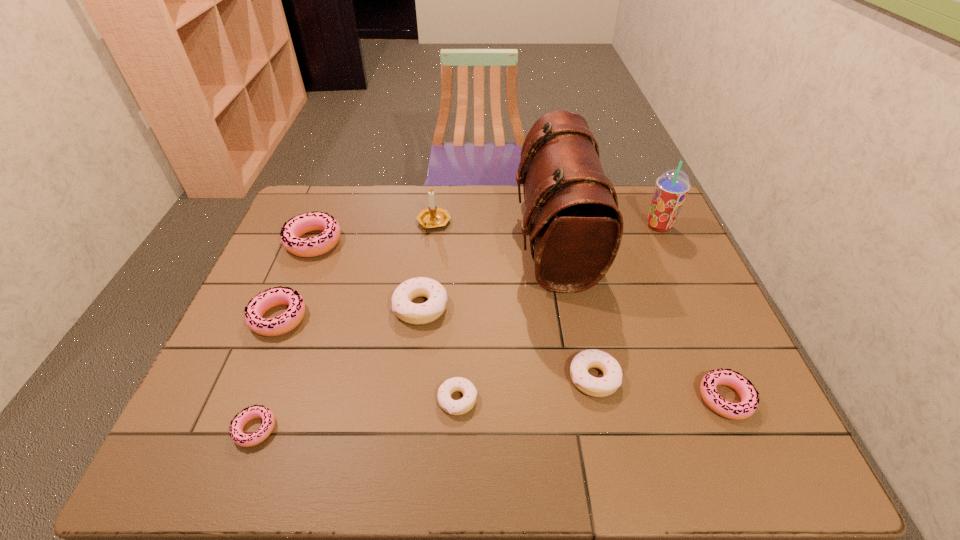
Find the location of `the second smallest white doughnut`. the second smallest white doughnut is located at coordinates pyautogui.click(x=597, y=387).

This screenshot has width=960, height=540. I want to click on the rightmost pink doughnut, so click(x=749, y=402).

What are the coordinates of `the third biggest pink doughnut` in the screenshot? It's located at (749, 402).

Locate an element on the screen. The height and width of the screenshot is (540, 960). the smallest white doughnut is located at coordinates (454, 407).

Locate an element on the screen. The width and height of the screenshot is (960, 540). the smallest pink doughnut is located at coordinates (256, 411).

I want to click on vacant area situated 0.390m on the front-facing side of the brown satchel, so click(x=394, y=240).

Locate an element on the screen. Image resolution: width=960 pixels, height=540 pixels. free space located 0.300m on the front-facing side of the brown satchel is located at coordinates coord(421,240).

Where is `free location located 0.350m on the front-facing side of the brown satchel`? free location located 0.350m on the front-facing side of the brown satchel is located at coordinates (406, 240).

Image resolution: width=960 pixels, height=540 pixels. Find the location of `free space located on the left of the ninth shortest object`. free space located on the left of the ninth shortest object is located at coordinates (601, 226).

You are a GUI agent. You are given a task and a screenshot of the screen. Output one action in this format:
    pyautogui.click(x=<x>, y=<y>)
    Task: Click on the vacant area located 0.390m on the right of the third tallest object
    This screenshot has width=960, height=540.
    Given the screenshot: What is the action you would take?
    pyautogui.click(x=567, y=222)